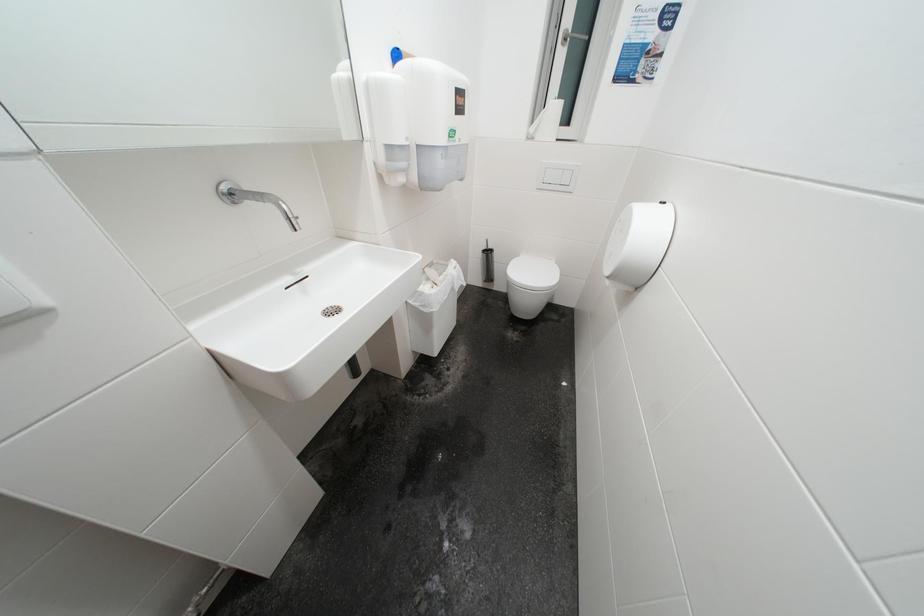
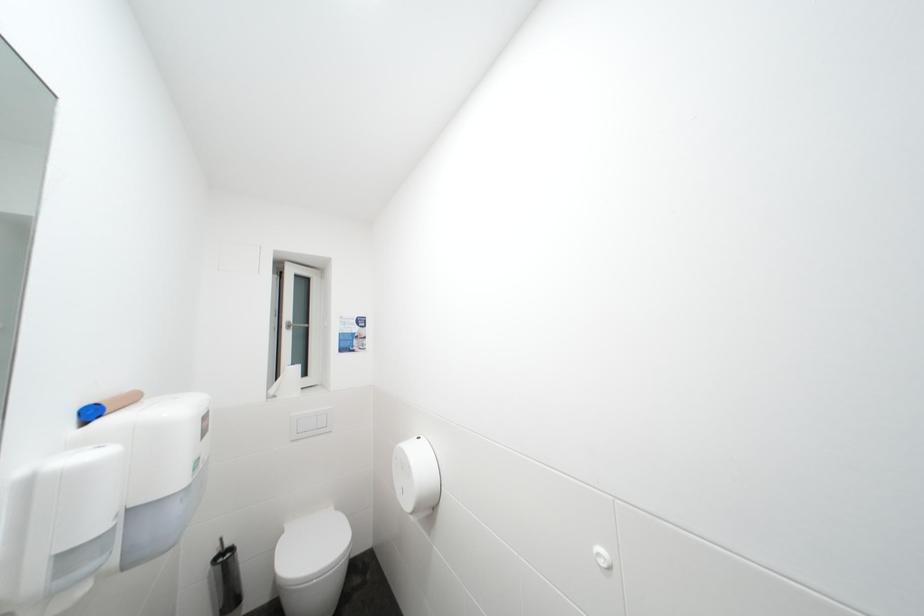
First-person continuous shooting, in which direction is the camera rotating?

The rotation direction of the camera is right-up.